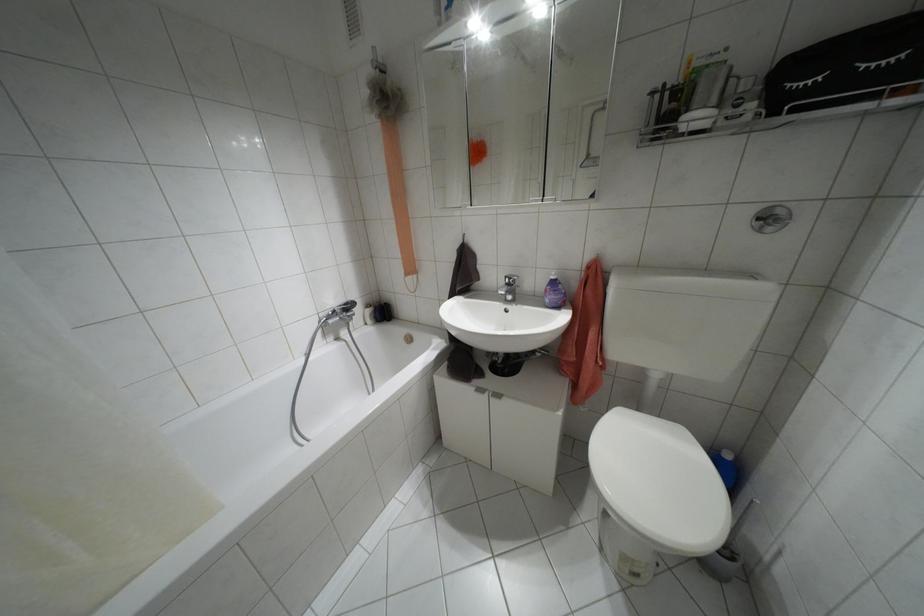
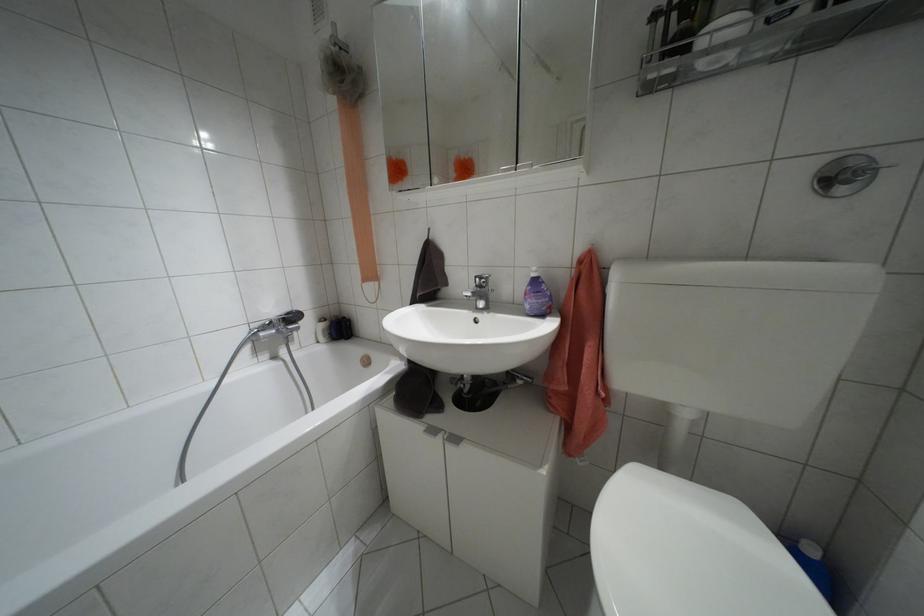
Find the pixel in the second image that matches (496,395) in the first image.

(455, 439)